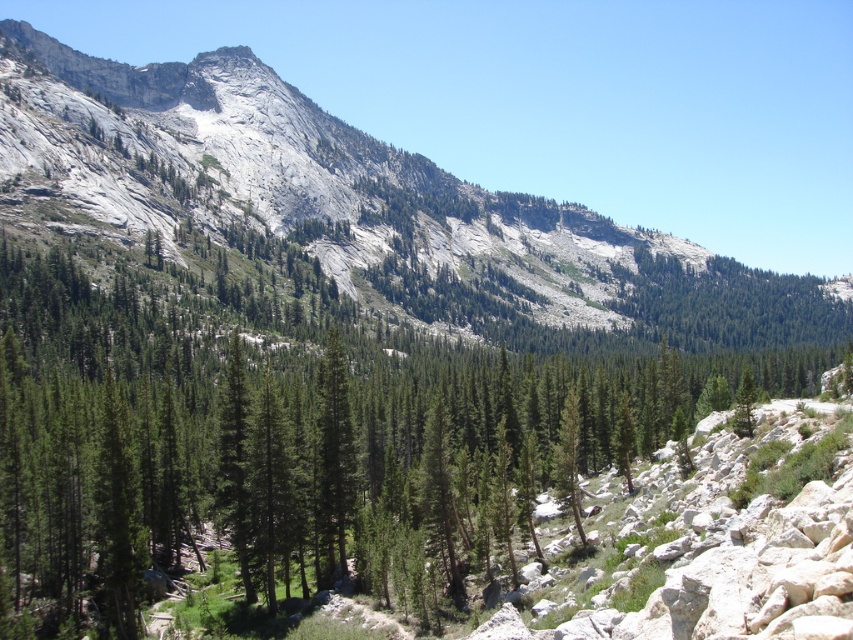
Who is lower down, green matte tree at center or gray rock mountain at center?

green matte tree at center is lower down.

Which is more to the left, green matte tree at center or gray rock mountain at center?

Positioned to the left is green matte tree at center.

This screenshot has height=640, width=853. In order to click on green matte tree at center in this screenshot , I will do `click(398, 468)`.

This screenshot has width=853, height=640. What are the coordinates of `green matte tree at center` in the screenshot? It's located at (398, 468).